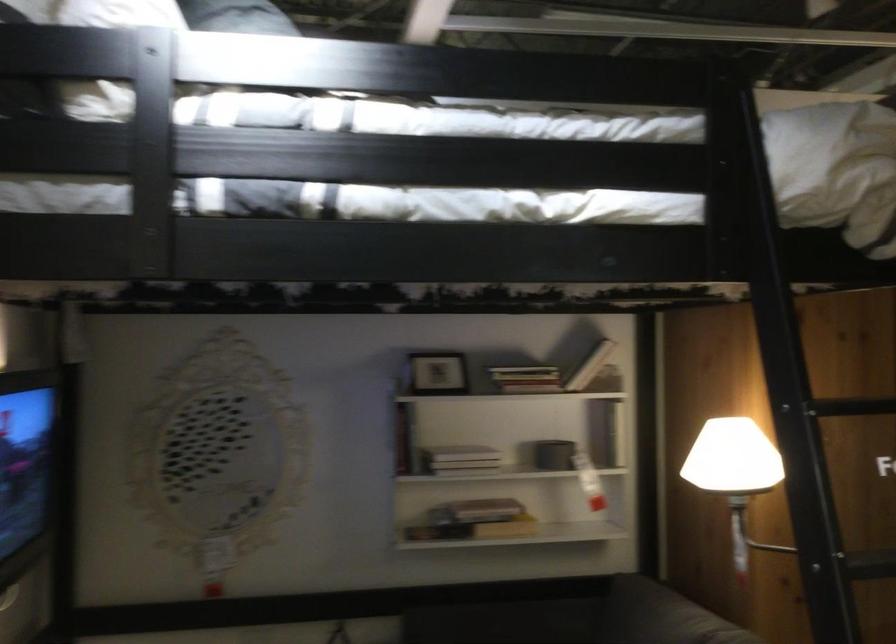
Find the location of a particular element. This screenshot has height=644, width=896. dark cylindrical cup is located at coordinates (553, 453).